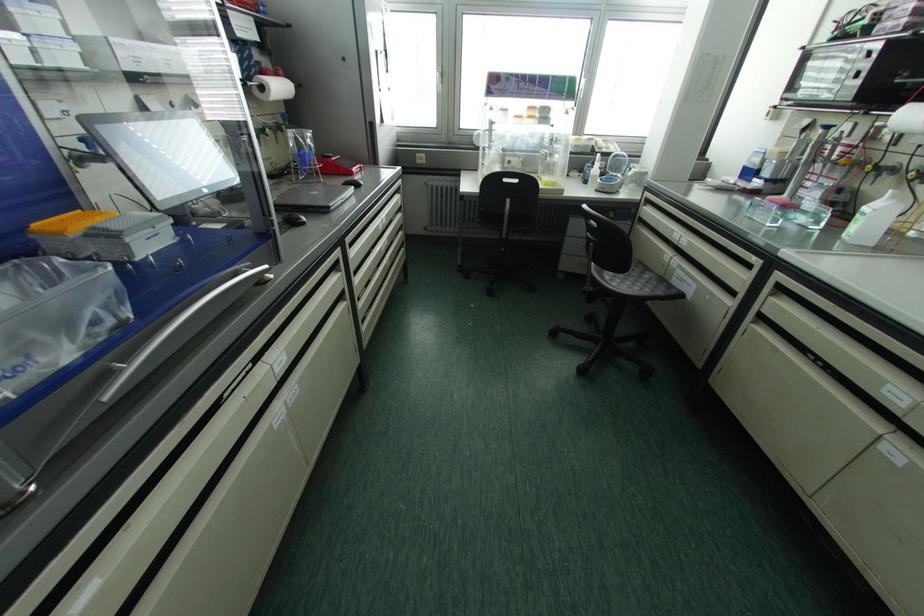
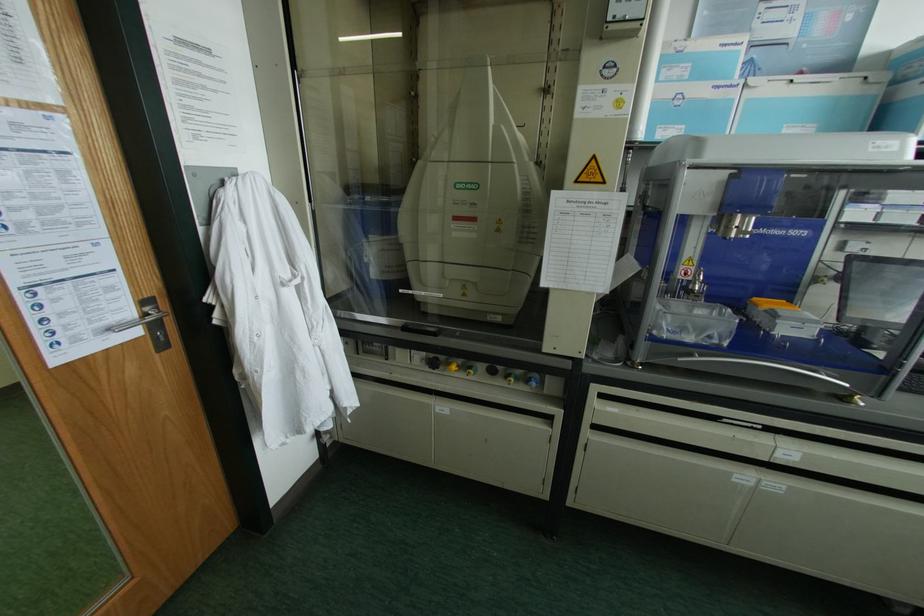
The first image is from the beginning of the video and the second image is from the end. How did the camera likely rotate when shooting the video?

The rotation direction of the camera is left-down.